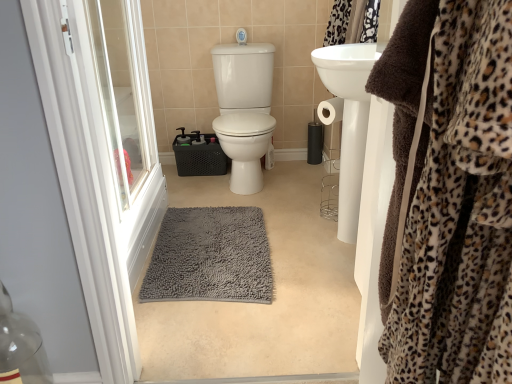
Where is `free location in front of gray shaggy bath mat at center`? The image size is (512, 384). free location in front of gray shaggy bath mat at center is located at coordinates (237, 334).